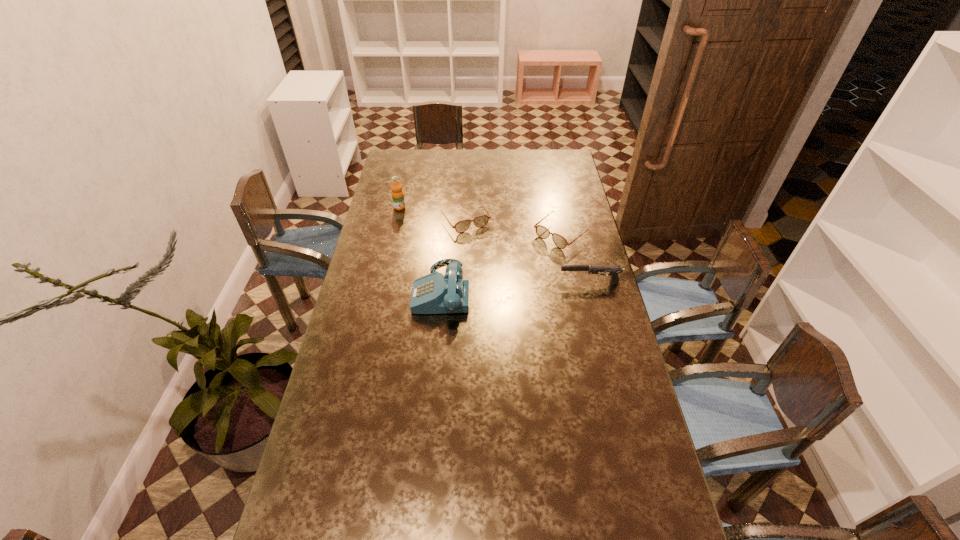
This screenshot has height=540, width=960. Find the location of `vacant space that's between the gun and the right sunglasses`. vacant space that's between the gun and the right sunglasses is located at coordinates (576, 258).

Locate an element on the screen. The height and width of the screenshot is (540, 960). vacant space in between the tallest object and the left sunglasses is located at coordinates (432, 213).

The width and height of the screenshot is (960, 540). I want to click on vacant space in between the second tallest object and the right sunglasses, so click(x=502, y=261).

Locate an element on the screen. The image size is (960, 540). unoccupied area between the tallest object and the gun is located at coordinates (494, 245).

Find the location of a particular element. The height and width of the screenshot is (540, 960). unoccupied position between the left sunglasses and the leftmost object is located at coordinates (432, 213).

Locate an element on the screen. The width and height of the screenshot is (960, 540). blank region between the left sunglasses and the right sunglasses is located at coordinates (514, 226).

Where is `vacant area that lies between the third shortest object and the telephone`? Image resolution: width=960 pixels, height=540 pixels. vacant area that lies between the third shortest object and the telephone is located at coordinates (516, 286).

Identify the location of unoccupied area between the right sunglasses and the left sunglasses. The width and height of the screenshot is (960, 540). (514, 226).

Identify which object is the closest to the fourth shortest object. Please provide its 2D coordinates. Your answer should be formatted as a tuple, i.e. [(x, y)], where the tuple contains the x and y coordinates of a point satisfying the conditions above.

[(480, 221)]

Where is `the closest object to the left sunglasses`? the closest object to the left sunglasses is located at coordinates (397, 193).